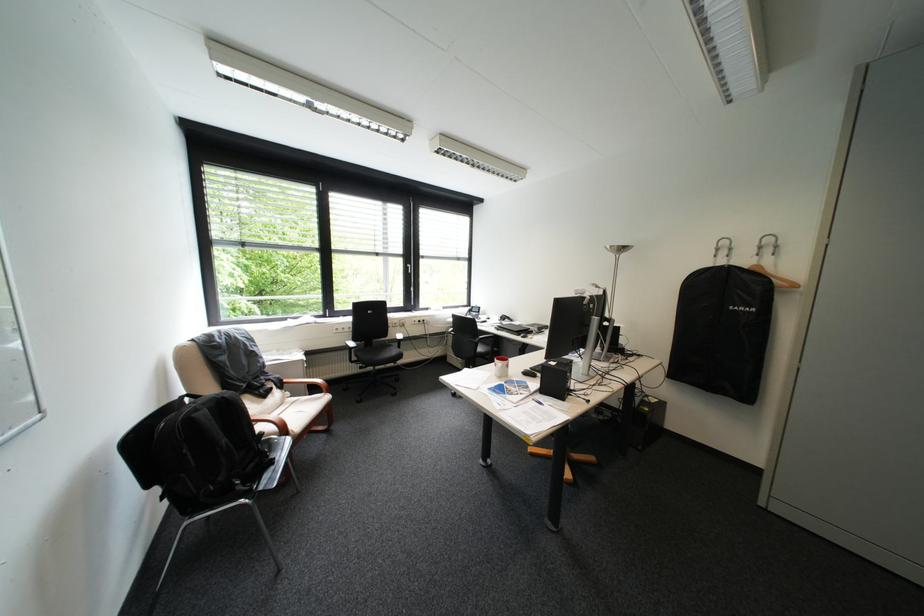
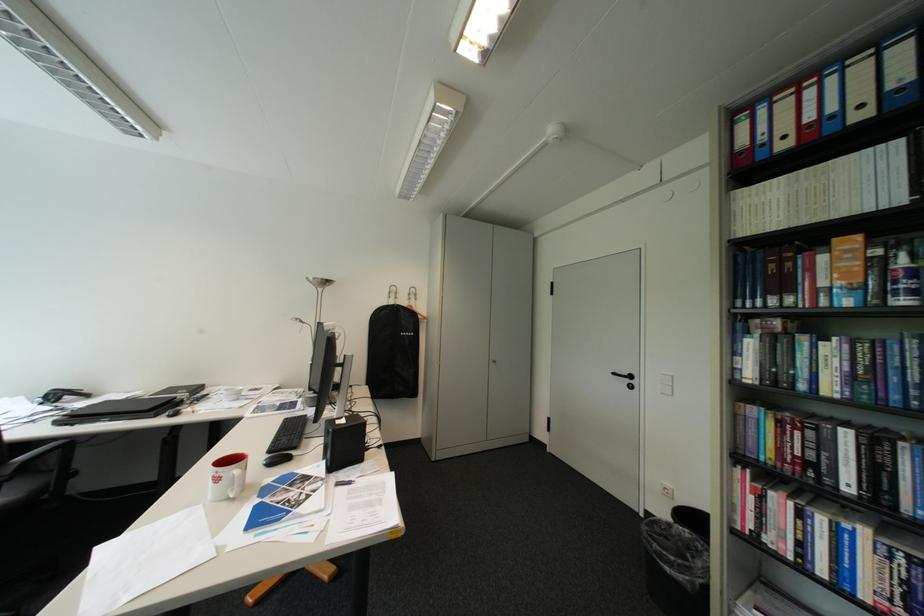
Locate, in the second image, the point that corresponds to (535,371) in the first image.

(276, 463)